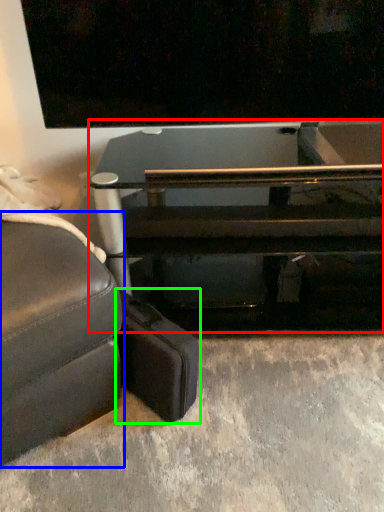
Question: Which object is the farthest from table (highlighted by a red box)? Choose among these: studio couch (highlighted by a blue box) or luggage (highlighted by a green box).

Choices:
 (A) studio couch
 (B) luggage

Answer: (A)